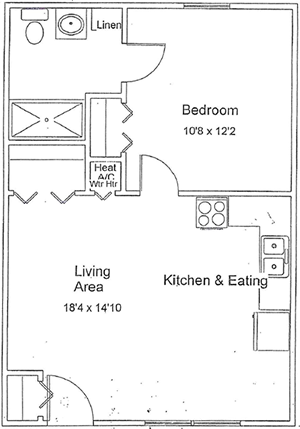
Where is `closet 2`? closet 2 is located at coordinates (114, 131).